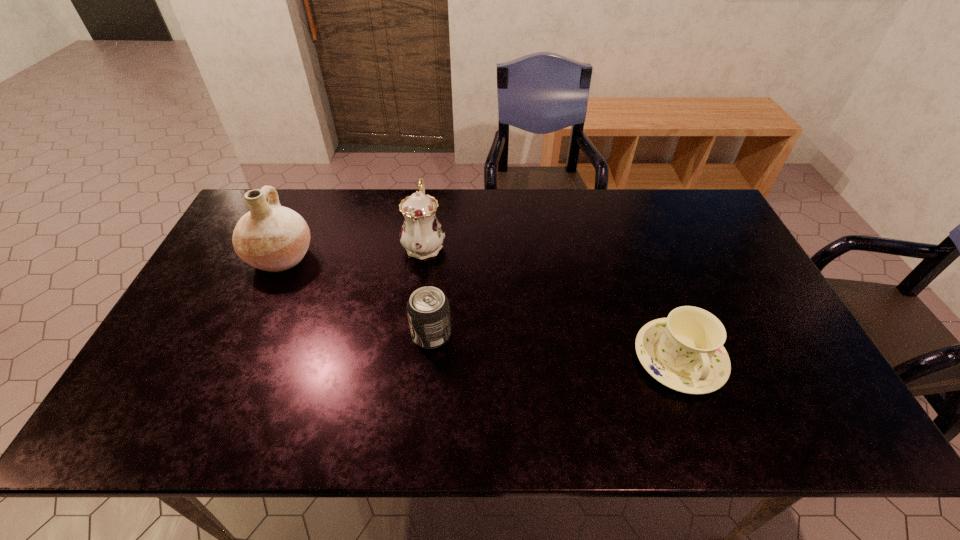
Where is `object that is positioned at the left edge`? The width and height of the screenshot is (960, 540). object that is positioned at the left edge is located at coordinates (270, 237).

Where is `free spot at the far edge of the desktop`? Image resolution: width=960 pixels, height=540 pixels. free spot at the far edge of the desktop is located at coordinates (547, 195).

At what (x,y) coordinates should I click in order to perform the action: click on vacant space at the near edge. Please return your answer as a coordinate pair (x, y). This screenshot has height=540, width=960. Looking at the image, I should click on (677, 416).

The width and height of the screenshot is (960, 540). Identify the location of vacant space at the left edge. (224, 322).

What are the coordinates of `vacant space at the right edge of the desktop` in the screenshot? It's located at (747, 287).

Identify the location of vacant area at the near right corner of the desktop. The width and height of the screenshot is (960, 540). (844, 424).

At what (x,y) coordinates should I click in order to perform the action: click on unoccupied area between the left chinaware and the leftmost object. Please return your answer as a coordinate pair (x, y). Looking at the image, I should click on (352, 251).

The height and width of the screenshot is (540, 960). I want to click on vacant region between the farther chinaware and the leftmost object, so click(352, 251).

This screenshot has height=540, width=960. Find the location of `free point between the left chinaware and the shorter chinaware`. free point between the left chinaware and the shorter chinaware is located at coordinates (552, 302).

This screenshot has height=540, width=960. Identify the location of free space between the leftmost object and the taller chinaware. (352, 251).